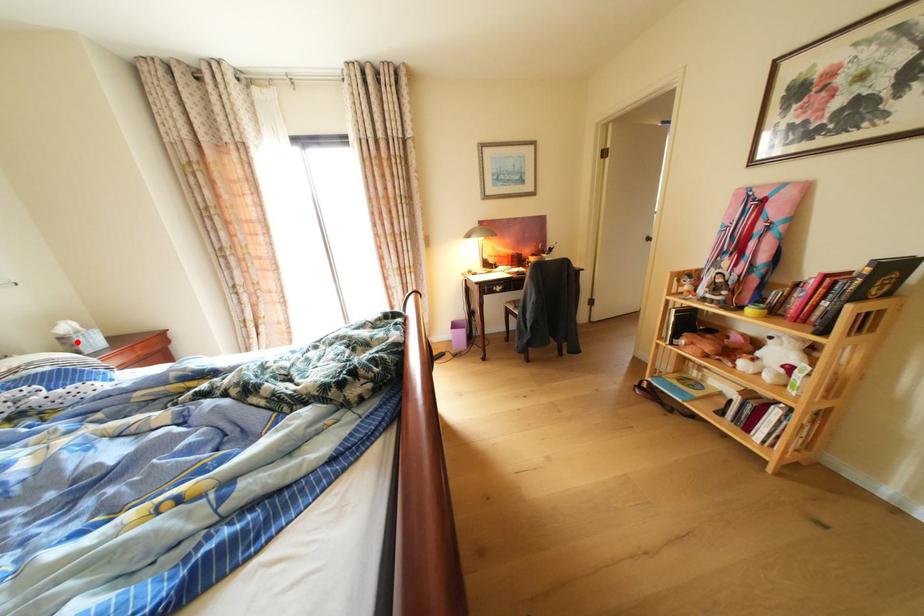
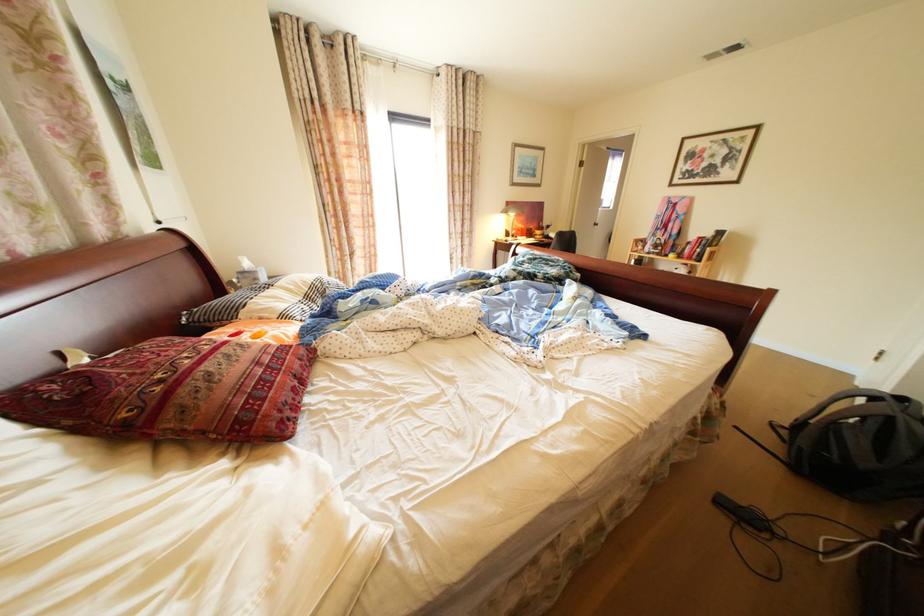
Locate, in the second image, the point that corresponds to the highlighted location in the first image.

(260, 277)